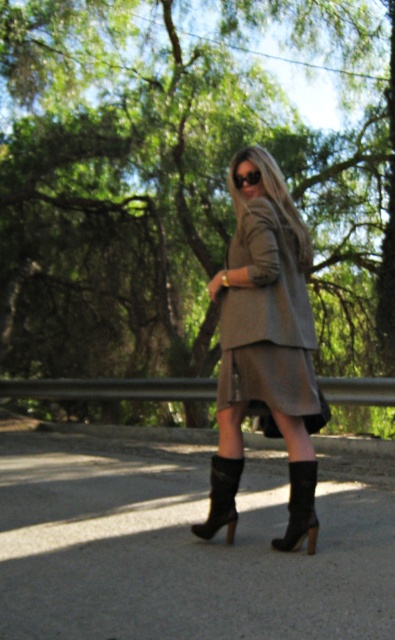
Question: Is matte gray coat at center positioned at the back of matte black sunglasses at center?

Choices:
 (A) no
 (B) yes

Answer: (A)

Question: Can you confirm if matte gray coat at center is bigger than black suede boot at lower center?

Choices:
 (A) yes
 (B) no

Answer: (A)

Question: Which of these objects is positioned closest to the matte gray dress at center?

Choices:
 (A) suede high-heeled boot at lower center
 (B) black suede boot at lower center
 (C) matte gray coat at center
 (D) matte black sunglasses at center

Answer: (C)

Question: Which point is farther to the camera?

Choices:
 (A) (225, 486)
 (B) (289, 509)
 (C) (302, 273)

Answer: (C)

Question: Does matte gray coat at center appear on the right side of black suede boot at lower center?

Choices:
 (A) no
 (B) yes

Answer: (A)

Question: Which of the following is the closest to the observer?

Choices:
 (A) suede high-heeled boot at lower center
 (B) matte gray dress at center

Answer: (B)